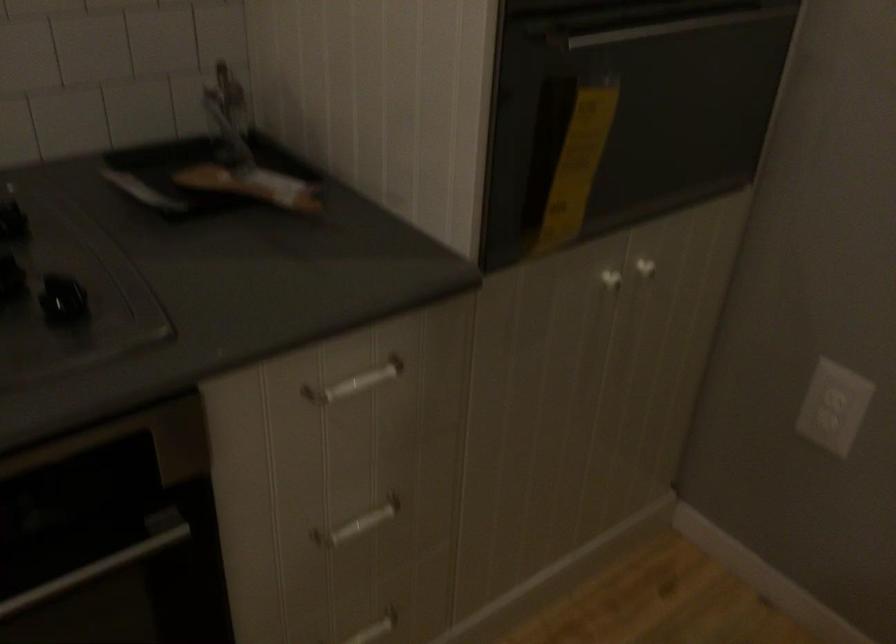
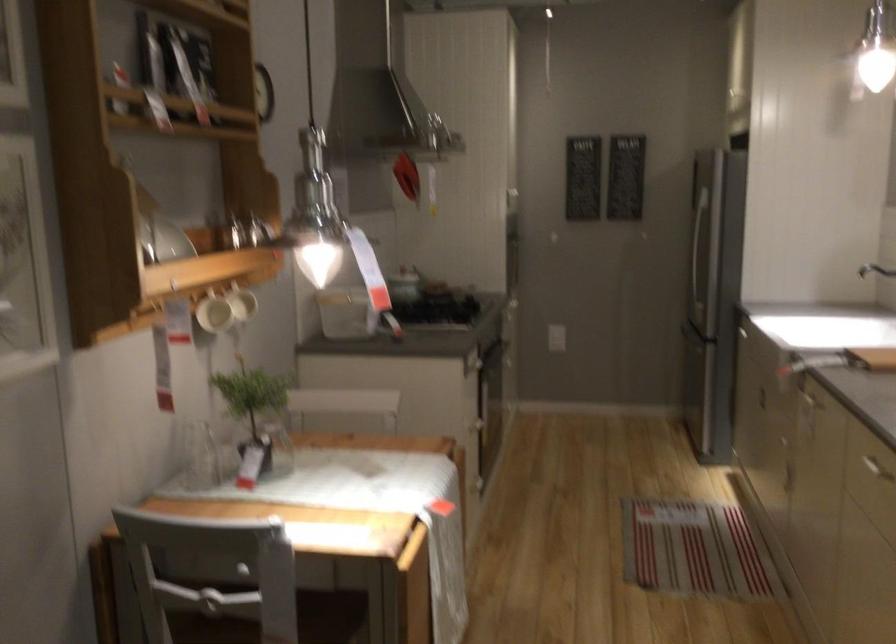
Question: I am providing you with two images of the same scene from different viewpoints. After the viewpoint changes to image2, which objects are now occluded?

Choices:
 (A) tape dispenser
 (B) white mug handle
 (C) white drawer handle
 (D) sink faucet handle

Answer: (C)